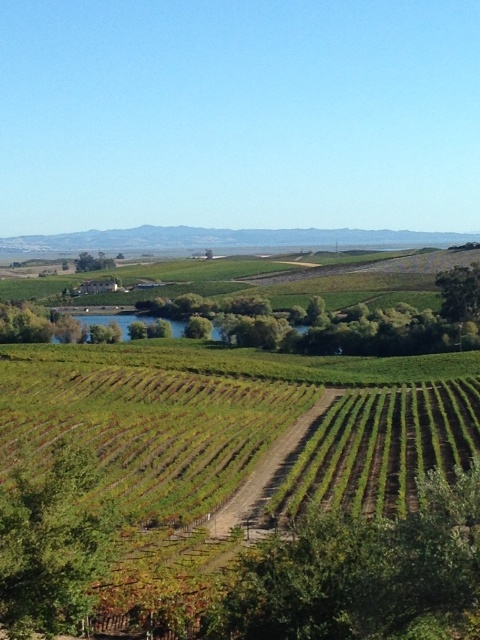
Is the position of green leafy tree at lower left more distant than that of green leafy tree at center-left?

No.

The height and width of the screenshot is (640, 480). I want to click on green leafy tree at lower left, so click(51, 545).

Is green leafy tree at lower left taller than green leafy tree at upper right?

Incorrect, green leafy tree at lower left's height is not larger of green leafy tree at upper right's.

Is green leafy tree at lower left in front of green leafy tree at upper right?

That is True.

Which is in front, point (21, 518) or point (467, 307)?

Point (21, 518)

Find the location of `green leafy tree at lower left`. green leafy tree at lower left is located at coordinates (51, 545).

Can you confirm if green leafy tree at upper right is taller than green leafy tree at center-left?

No, green leafy tree at upper right is not taller than green leafy tree at center-left.

Does point (459, 266) come closer to viewer compared to point (88, 257)?

Yes, point (459, 266) is closer to viewer.

Who is more distant from viewer, (445, 307) or (82, 268)?

Point (82, 268)

Identify the location of green leafy tree at upper right. [459, 292].